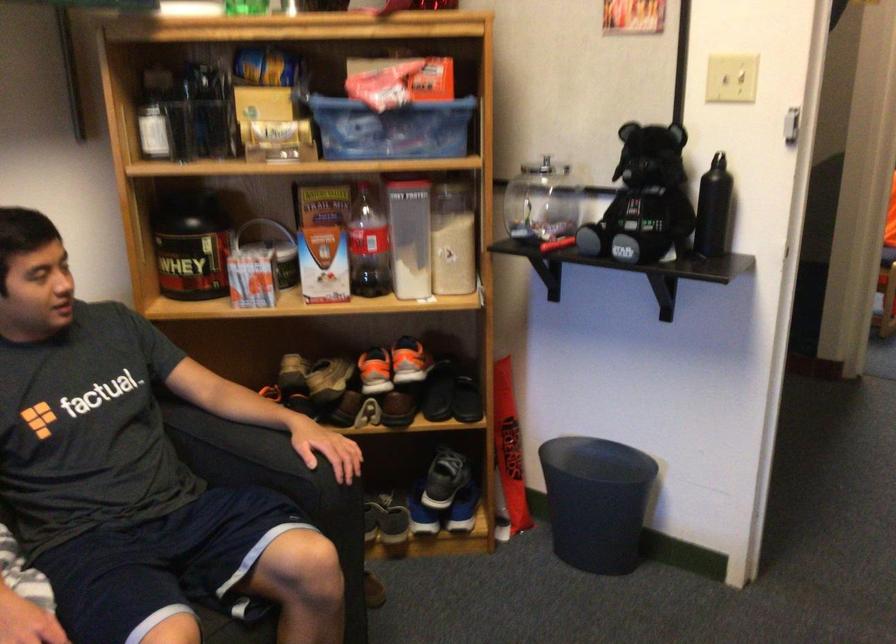
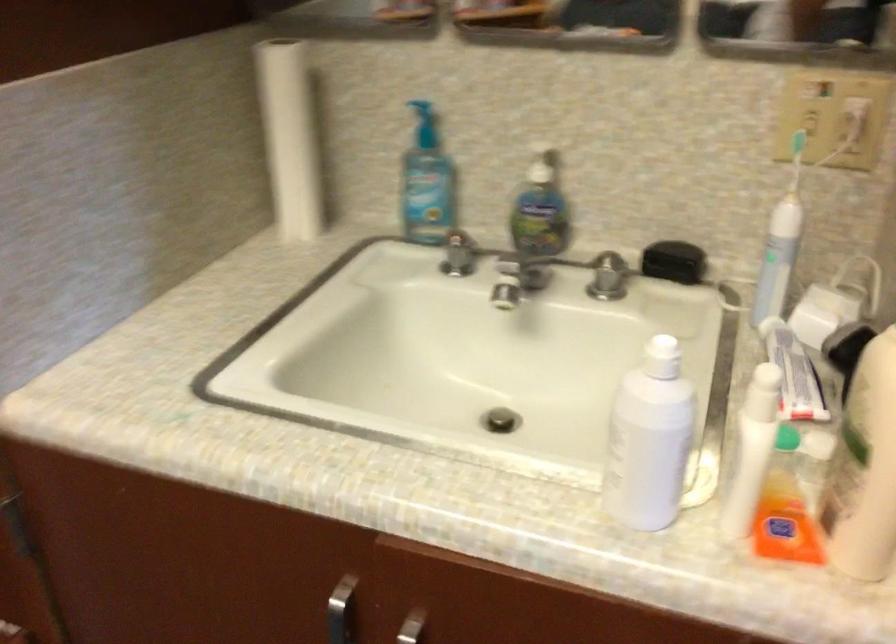
First-person continuous shooting, in which direction is the camera rotating?

The camera rotated toward right-down.